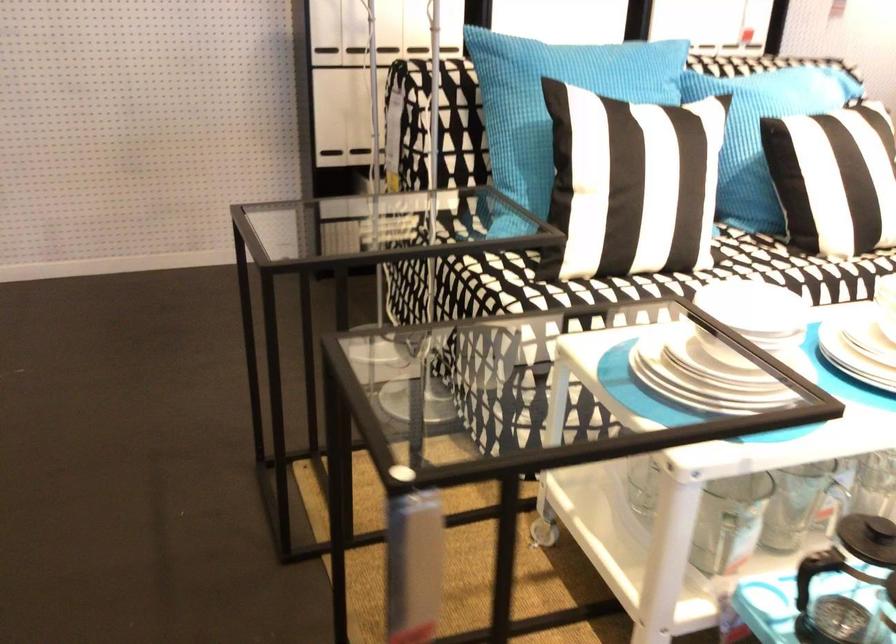
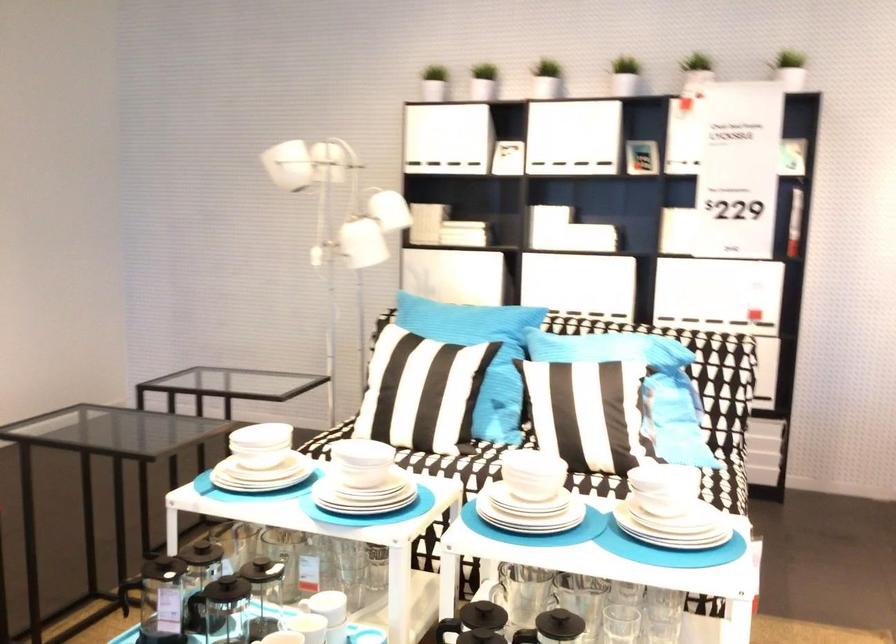
Question: I am providing you with two images of the same scene from different viewpoints. After the viewpoint changes to image2, which objects are now occluded?

Choices:
 (A) green lotion bottle
 (B) sofa sitting surface
 (C) small potted plant
 (D) black press plunger

Answer: (B)